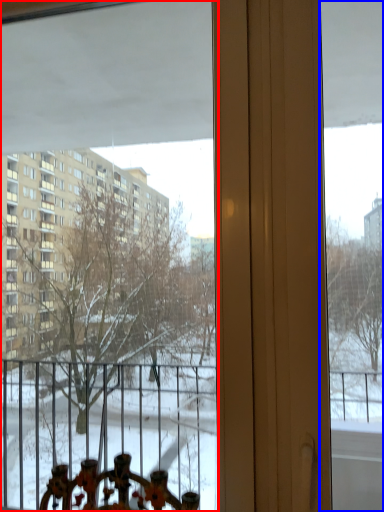
Question: Which of the following is the closest to the observer, window (highlighted by a red box) or window screen (highlighted by a blue box)?

Choices:
 (A) window
 (B) window screen

Answer: (B)